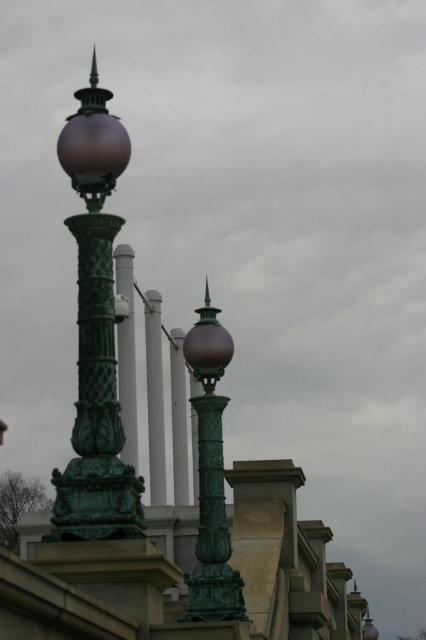
Who is taller, green patinated metal street light at left or green metal pole at center?

green metal pole at center is taller.

Does green patinated metal street light at left appear on the right side of green metal pole at center?

Yes, green patinated metal street light at left is to the right of green metal pole at center.

Find the location of a particular element. The image size is (426, 640). green patinated metal street light at left is located at coordinates (95, 337).

Identify the location of green patinated metal street light at left. (95, 337).

Consider the image. Between green patinated metal street light at left and green patinated metal street light at center, which one is positioned higher?

Positioned higher is green patinated metal street light at left.

Based on the photo, does green patinated metal street light at left have a greater width compared to green patinated metal street light at center?

Indeed, green patinated metal street light at left has a greater width compared to green patinated metal street light at center.

Who is more forward, (100,339) or (192,604)?

Point (100,339) is more forward.

Where is `green patinated metal street light at left`? The height and width of the screenshot is (640, 426). green patinated metal street light at left is located at coordinates (95, 337).

Is green patinated metal street light at center above green metal pole at center?

Yes, green patinated metal street light at center is above green metal pole at center.

Can you confirm if green patinated metal street light at center is smaller than green metal pole at center?

Correct, green patinated metal street light at center occupies less space than green metal pole at center.

Who is more forward, [213,467] or [149,440]?

Positioned in front is point [213,467].

Locate an element on the screen. green patinated metal street light at center is located at coordinates (210, 477).